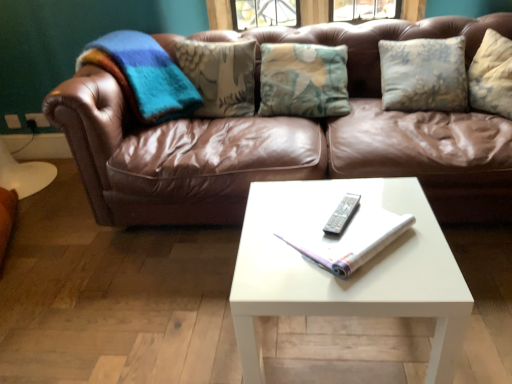
Locate an element on the screen. This screenshot has height=384, width=512. free space that is to the left of silver metallic remote at center is located at coordinates (306, 226).